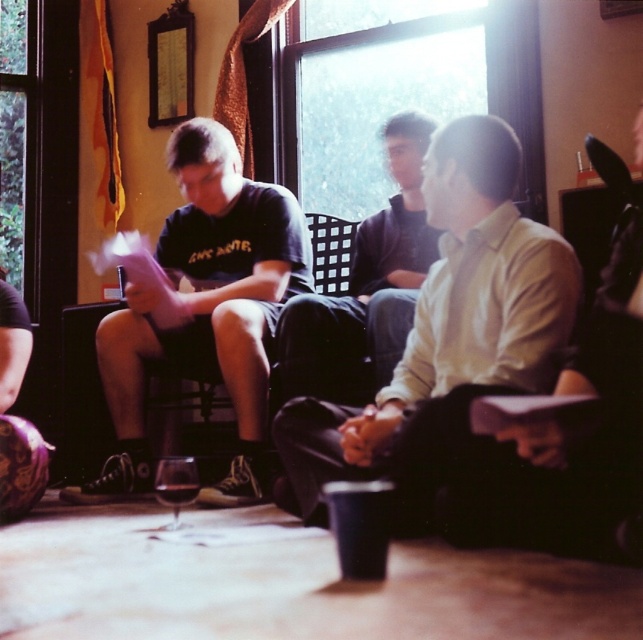
Looking at this image, can you confirm if light beige shirt at center is positioned above matte black t-shirt at center?

Incorrect, light beige shirt at center is not positioned above matte black t-shirt at center.

Measure the distance between light beige shirt at center and matte black t-shirt at center.

light beige shirt at center and matte black t-shirt at center are 85.34 centimeters apart.

What do you see at coordinates (448, 316) in the screenshot?
I see `light beige shirt at center` at bounding box center [448, 316].

You are a GUI agent. You are given a task and a screenshot of the screen. Output one action in this format:
    pyautogui.click(x=<x>, y=<y>)
    Task: Click on the light beige shirt at center
    The image size is (643, 640).
    Given the screenshot: What is the action you would take?
    pyautogui.click(x=448, y=316)

Who is lower down, matte black t-shirt at center or transparent glass at lower center?

Positioned lower is transparent glass at lower center.

Measure the distance between matte black t-shirt at center and transparent glass at lower center.

matte black t-shirt at center is 24.33 inches from transparent glass at lower center.

Locate an element on the screen. The height and width of the screenshot is (640, 643). matte black t-shirt at center is located at coordinates (206, 305).

I want to click on matte black t-shirt at center, so click(206, 305).

Does matte black t-shirt at center have a lesser width compared to translucent glass wine at lower center?

Incorrect, matte black t-shirt at center's width is not less than translucent glass wine at lower center's.

Who is taller, matte black t-shirt at center or translucent glass wine at lower center?

With more height is matte black t-shirt at center.

Identify the location of matte black t-shirt at center. The image size is (643, 640). (206, 305).

This screenshot has height=640, width=643. Identify the location of matte black t-shirt at center. (206, 305).